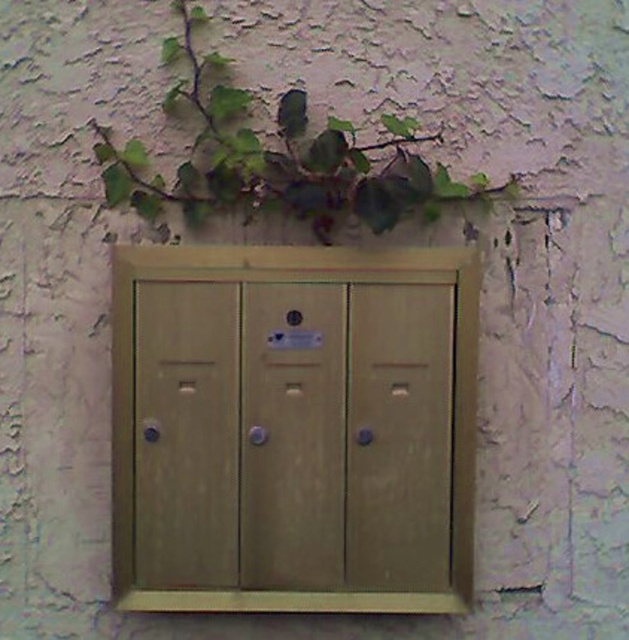
Question: Where is wooden locker at center located in relation to green leafy plant at upper center in the image?

Choices:
 (A) above
 (B) below

Answer: (B)

Question: Which object is closer to the camera taking this photo?

Choices:
 (A) green leafy plant at upper center
 (B) wooden locker at center

Answer: (A)

Question: Where is wooden locker at center located in relation to green leafy plant at upper center in the image?

Choices:
 (A) left
 (B) right

Answer: (A)

Question: Which point is closer to the camera?

Choices:
 (A) (452, 360)
 (B) (194, 164)

Answer: (A)

Question: Can you confirm if wooden locker at center is positioned below green leafy plant at upper center?

Choices:
 (A) yes
 (B) no

Answer: (A)